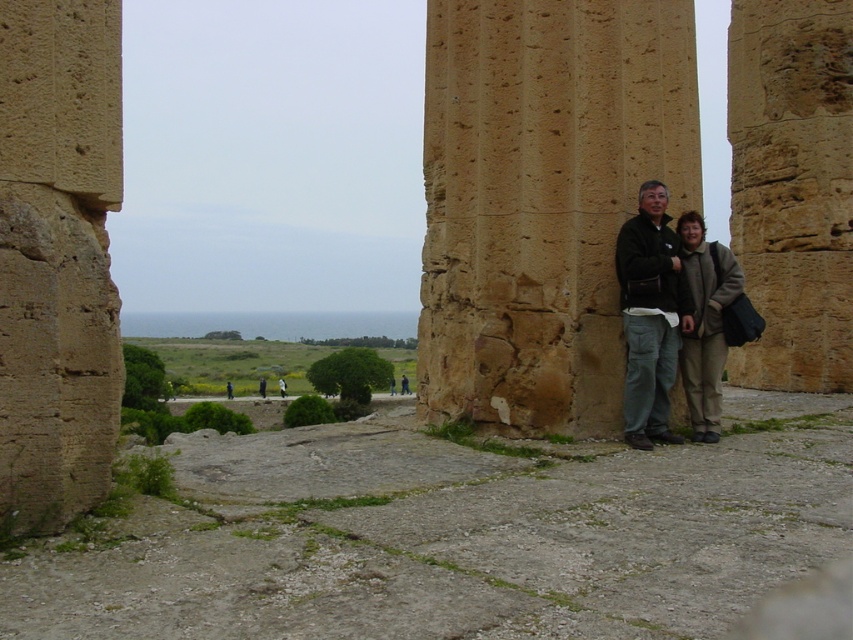
You are standing at the archaeological site and want to take a photo of both point [660,189] and point [712,406]. Which point will appear larger in your photo?

Point [660,189] is closer to the camera than point [712,406], so it will appear larger in the photo.

You are an archaeologist standing at the archaeological site. You notice a beige stone pillar at center and a matte brown jacket at center. Which object is positioned higher from the ground?

The beige stone pillar at center is located above the matte brown jacket at center, so it is positioned higher from the ground.

You are an archaeologist examining the beige stone pillar at center and the matte brown jacket at center. Which object is wider?

The matte brown jacket at center is wider than the beige stone pillar at center.